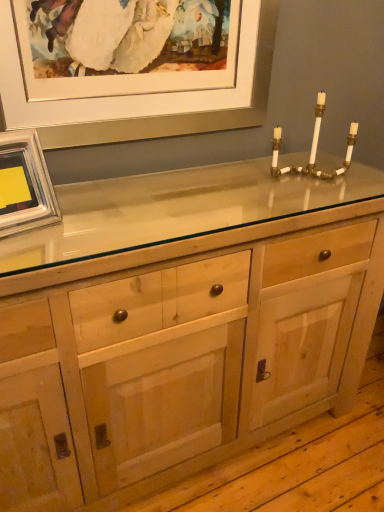
Measure the distance between point (42, 175) and camera.

A distance of 38.50 inches exists between point (42, 175) and camera.

Measure the distance between silver metallic picture frame at upper left, arranged as the 2th picture frame when viewed from the top, and camera.

silver metallic picture frame at upper left, arranged as the 2th picture frame when viewed from the top, and camera are 36.54 inches apart from each other.

What do you see at coordinates (313, 148) in the screenshot?
I see `white ceramic candle holder at upper right` at bounding box center [313, 148].

Describe the element at coordinates (182, 356) in the screenshot. Image resolution: width=384 pixels, height=512 pixels. I see `natural wood cabinet at center` at that location.

What do you see at coordinates (144, 95) in the screenshot? I see `matte white picture frame at upper center, arranged as the second picture frame when ordered from the bottom` at bounding box center [144, 95].

Locate an element on the screen. silver metallic picture frame at upper left, arranged as the first picture frame when ordered from the bottom is located at coordinates (24, 184).

Could you tell me if silver metallic picture frame at upper left, arranged as the first picture frame when ordered from the bottom, is facing matte white picture frame at upper center, arranged as the second picture frame when ordered from the bottom?

No, silver metallic picture frame at upper left, arranged as the first picture frame when ordered from the bottom, does not turn towards matte white picture frame at upper center, arranged as the second picture frame when ordered from the bottom.

Is silver metallic picture frame at upper left, arranged as the 2th picture frame when viewed from the top, next to matte white picture frame at upper center, the 1th picture frame positioned from the top?

No, silver metallic picture frame at upper left, arranged as the 2th picture frame when viewed from the top, is not with matte white picture frame at upper center, the 1th picture frame positioned from the top.

Between point (27, 219) and point (245, 50), which one is positioned behind?

The point (245, 50) is farther from the camera.

Considering the sizes of objects white ceramic candle holder at upper right and matte white picture frame at upper center, arranged as the second picture frame when ordered from the bottom, in the image provided, who is smaller, white ceramic candle holder at upper right or matte white picture frame at upper center, arranged as the second picture frame when ordered from the bottom,?

Smaller between the two is white ceramic candle holder at upper right.

Could you tell me if white ceramic candle holder at upper right is facing matte white picture frame at upper center, the 1th picture frame positioned from the top?

No, white ceramic candle holder at upper right is not aimed at matte white picture frame at upper center, the 1th picture frame positioned from the top.

Is white ceramic candle holder at upper right wider than matte white picture frame at upper center, arranged as the second picture frame when ordered from the bottom?

Correct, the width of white ceramic candle holder at upper right exceeds that of matte white picture frame at upper center, arranged as the second picture frame when ordered from the bottom.

From a real-world perspective, which is physically above, matte white picture frame at upper center, the 1th picture frame positioned from the top, or white ceramic candle holder at upper right?

matte white picture frame at upper center, the 1th picture frame positioned from the top.

Locate an element on the screen. the 1st picture frame to the left of the white ceramic candle holder at upper right, counting from the anchor's position is located at coordinates coord(144,95).

Is matte white picture frame at upper center, the 1th picture frame positioned from the top, smaller than white ceramic candle holder at upper right?

Actually, matte white picture frame at upper center, the 1th picture frame positioned from the top, might be larger than white ceramic candle holder at upper right.

Identify the location of the 1st picture frame behind the natural wood cabinet at center. (24, 184).

Is natural wood cabinet at center in contact with silver metallic picture frame at upper left, arranged as the 2th picture frame when viewed from the top?

natural wood cabinet at center and silver metallic picture frame at upper left, arranged as the 2th picture frame when viewed from the top, are clearly separated.

Is natural wood cabinet at center at the right side of silver metallic picture frame at upper left, arranged as the first picture frame when ordered from the bottom?

Correct, you'll find natural wood cabinet at center to the right of silver metallic picture frame at upper left, arranged as the first picture frame when ordered from the bottom.

Can you confirm if natural wood cabinet at center is shorter than silver metallic picture frame at upper left, arranged as the 2th picture frame when viewed from the top?

No, natural wood cabinet at center is not shorter than silver metallic picture frame at upper left, arranged as the 2th picture frame when viewed from the top.

Locate an element on the screen. picture frame that appears above the silver metallic picture frame at upper left, arranged as the 2th picture frame when viewed from the top (from the image's perspective) is located at coordinates (144, 95).

Is matte white picture frame at upper center, arranged as the second picture frame when ordered from the bottom, directly adjacent to silver metallic picture frame at upper left, arranged as the 2th picture frame when viewed from the top?

No, matte white picture frame at upper center, arranged as the second picture frame when ordered from the bottom, is not in contact with silver metallic picture frame at upper left, arranged as the 2th picture frame when viewed from the top.

Which of these two, matte white picture frame at upper center, the 1th picture frame positioned from the top, or silver metallic picture frame at upper left, arranged as the 2th picture frame when viewed from the top, stands shorter?

With less height is silver metallic picture frame at upper left, arranged as the 2th picture frame when viewed from the top.

Is matte white picture frame at upper center, arranged as the second picture frame when ordered from the bottom, outside of silver metallic picture frame at upper left, arranged as the 2th picture frame when viewed from the top?

matte white picture frame at upper center, arranged as the second picture frame when ordered from the bottom, is positioned outside silver metallic picture frame at upper left, arranged as the 2th picture frame when viewed from the top.

Is white ceramic candle holder at upper right wider or thinner than natural wood cabinet at center?

white ceramic candle holder at upper right is thinner than natural wood cabinet at center.

Which is behind, point (321, 94) or point (192, 252)?

Positioned behind is point (321, 94).

From the image's perspective, between white ceramic candle holder at upper right and natural wood cabinet at center, which one is located above?

From the image's view, white ceramic candle holder at upper right is above.

Is silver metallic picture frame at upper left, arranged as the 2th picture frame when viewed from the top, outside of white ceramic candle holder at upper right?

silver metallic picture frame at upper left, arranged as the 2th picture frame when viewed from the top, lies outside white ceramic candle holder at upper right's area.

Which point is more forward, (44,178) or (316,152)?

Point (44,178)

Image resolution: width=384 pixels, height=512 pixels. In order to click on picture frame below the white ceramic candle holder at upper right (from the image's perspective) in this screenshot , I will do `click(24, 184)`.

From the image's perspective, who appears lower, silver metallic picture frame at upper left, arranged as the 2th picture frame when viewed from the top, or white ceramic candle holder at upper right?

From the image's view, silver metallic picture frame at upper left, arranged as the 2th picture frame when viewed from the top, is below.

The height and width of the screenshot is (512, 384). Identify the location of picture frame lying on the right of silver metallic picture frame at upper left, arranged as the 2th picture frame when viewed from the top. (144, 95).

Image resolution: width=384 pixels, height=512 pixels. What are the coordinates of `the 1st picture frame in front of the white ceramic candle holder at upper right, starting your count from the anchor` in the screenshot? It's located at (144, 95).

Based on the photo, based on their spatial positions, is natural wood cabinet at center or white ceramic candle holder at upper right closer to matte white picture frame at upper center, arranged as the second picture frame when ordered from the bottom?

Among the two, white ceramic candle holder at upper right is located nearer to matte white picture frame at upper center, arranged as the second picture frame when ordered from the bottom.

Estimate the real-world distances between objects in this image. Which object is further from white ceramic candle holder at upper right, natural wood cabinet at center or matte white picture frame at upper center, the 1th picture frame positioned from the top?

natural wood cabinet at center is positioned further to the anchor white ceramic candle holder at upper right.

Looking at the image, which one is located further to matte white picture frame at upper center, arranged as the second picture frame when ordered from the bottom, white ceramic candle holder at upper right or natural wood cabinet at center?

natural wood cabinet at center lies further to matte white picture frame at upper center, arranged as the second picture frame when ordered from the bottom, than the other object.

Estimate the real-world distances between objects in this image. Which object is further from white ceramic candle holder at upper right, matte white picture frame at upper center, the 1th picture frame positioned from the top, or natural wood cabinet at center?

Among the two, natural wood cabinet at center is located further to white ceramic candle holder at upper right.

Looking at the image, which one is located further to natural wood cabinet at center, matte white picture frame at upper center, arranged as the second picture frame when ordered from the bottom, or white ceramic candle holder at upper right?

matte white picture frame at upper center, arranged as the second picture frame when ordered from the bottom.

When comparing their distances from natural wood cabinet at center, does white ceramic candle holder at upper right or matte white picture frame at upper center, arranged as the second picture frame when ordered from the bottom, seem closer?

white ceramic candle holder at upper right lies closer to natural wood cabinet at center than the other object.

From the image, which object appears to be farther from silver metallic picture frame at upper left, arranged as the first picture frame when ordered from the bottom, matte white picture frame at upper center, the 1th picture frame positioned from the top, or white ceramic candle holder at upper right?

white ceramic candle holder at upper right is positioned further to the anchor silver metallic picture frame at upper left, arranged as the first picture frame when ordered from the bottom.

Considering their positions, is silver metallic picture frame at upper left, arranged as the first picture frame when ordered from the bottom, positioned further to white ceramic candle holder at upper right than matte white picture frame at upper center, the 1th picture frame positioned from the top?

The object further to white ceramic candle holder at upper right is silver metallic picture frame at upper left, arranged as the first picture frame when ordered from the bottom.

Locate an element on the screen. This screenshot has height=512, width=384. picture frame between matte white picture frame at upper center, the 1th picture frame positioned from the top, and natural wood cabinet at center vertically is located at coordinates (24, 184).

Identify the location of picture frame between silver metallic picture frame at upper left, arranged as the first picture frame when ordered from the bottom, and white ceramic candle holder at upper right, in the horizontal direction. (144, 95).

Locate an element on the screen. The height and width of the screenshot is (512, 384). chest of drawers between silver metallic picture frame at upper left, arranged as the first picture frame when ordered from the bottom, and white ceramic candle holder at upper right from left to right is located at coordinates 182,356.

Where is `candle holder between matte white picture frame at upper center, the 1th picture frame positioned from the top, and natural wood cabinet at center in the up-down direction`? Image resolution: width=384 pixels, height=512 pixels. candle holder between matte white picture frame at upper center, the 1th picture frame positioned from the top, and natural wood cabinet at center in the up-down direction is located at coordinates (313, 148).